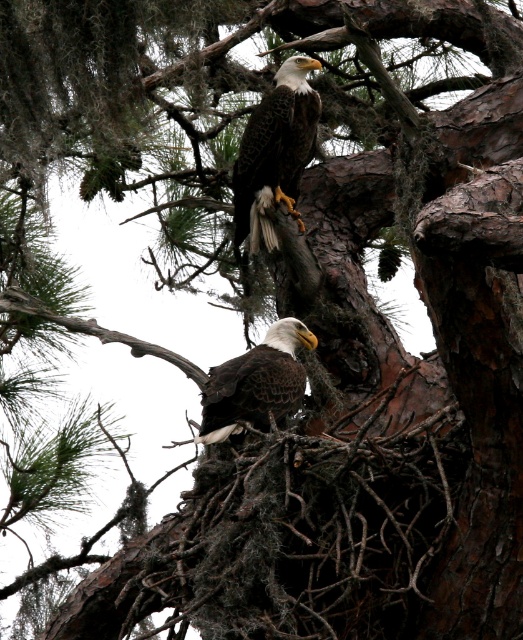
You are an ornithologist observing two bald eagles in their nest. You notice dark brown feathers at upper center and dark brown feathers at center. Which set of feathers is closer to your viewpoint?

The dark brown feathers at upper center are closer to your viewpoint because the dark brown feathers at center are positioned behind them.

You are a wildlife photographer observing two bald eagles in their nest. You notice dark brown feathers at upper center and dark brown feathers at center. Which set of feathers is larger?

The dark brown feathers at center are larger than the dark brown feathers at upper center.

You are a wildlife photographer aiming to capture the dark brown feathers at upper center of the bald eagle. Based on the provided coordinates, where should you focus your camera to ensure the feathers are in the center of your shot?

The dark brown feathers at upper center are located at coordinates point (275, 152), so you should focus your camera there to center them in your shot.